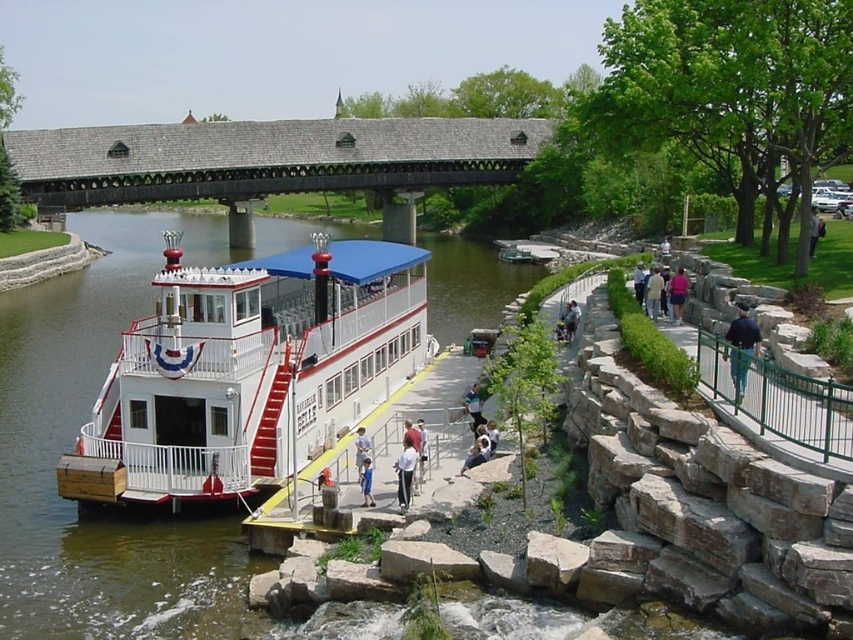
You are standing at the riverside and see two points marked on the image. Which point is closer to you, point (44, 346) or point (735, 337)?

Point (44, 346) is closer to you because it is further to the viewer than point (735, 337).

You are standing at the covered bridge and want to walk towards the two points marked in the image. Which point, point (666, 291) or point (819, 225), is closer to you?

Point (666, 291) is in front of point (819, 225), so it is closer to you.